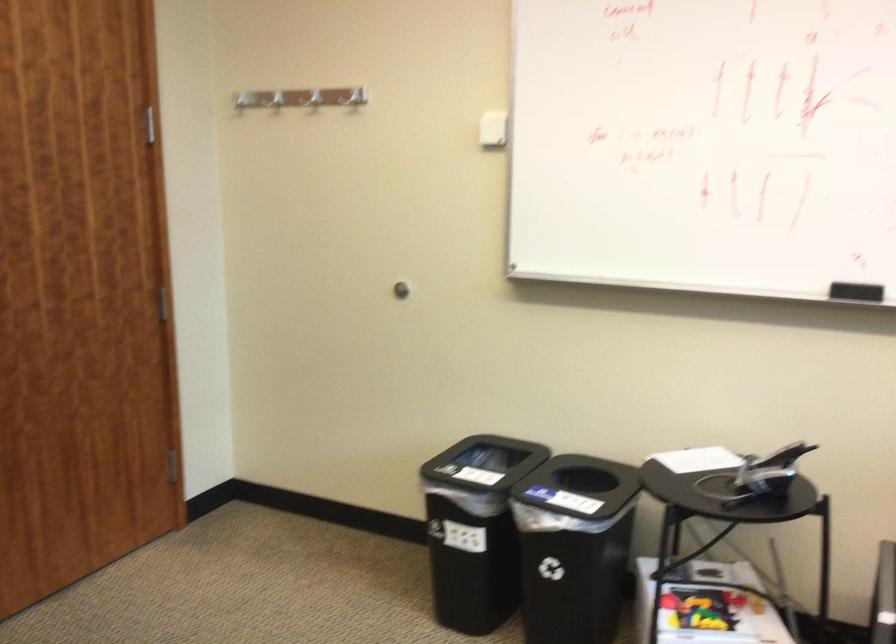
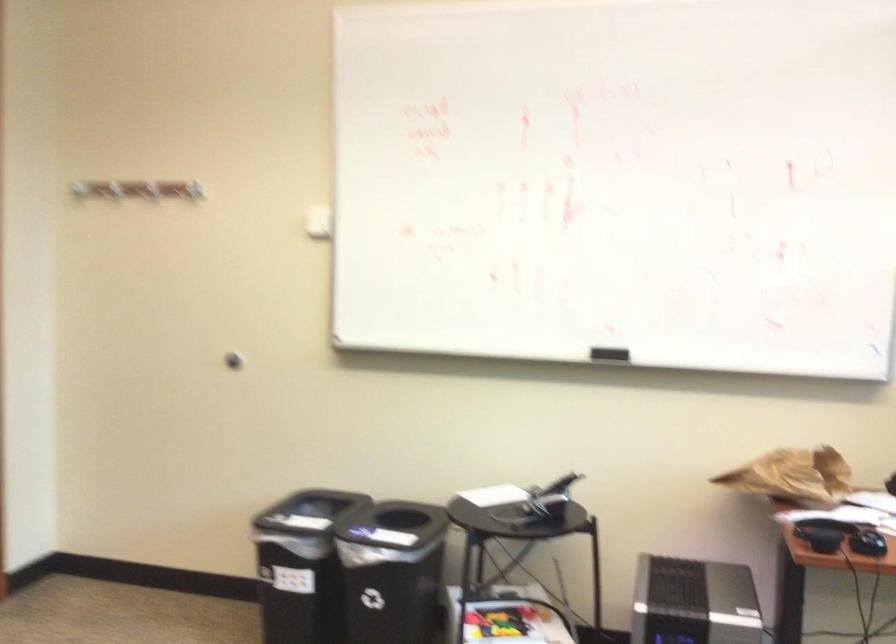
Where in the second image is the point corresponding to pixel 489 133 from the first image?

(317, 222)